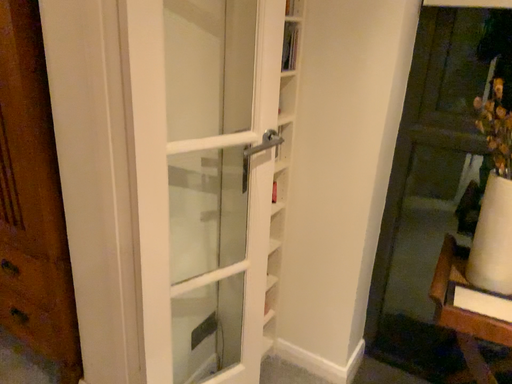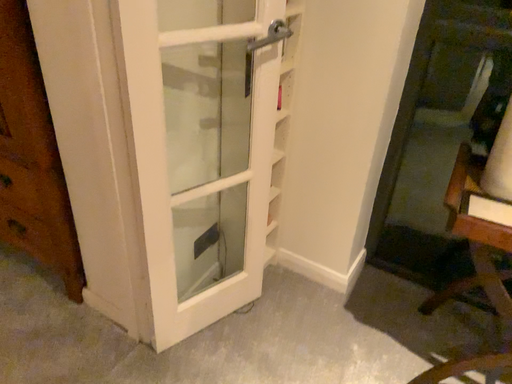
Question: How did the camera likely rotate when shooting the video?

Choices:
 (A) rotated downward
 (B) rotated upward

Answer: (A)